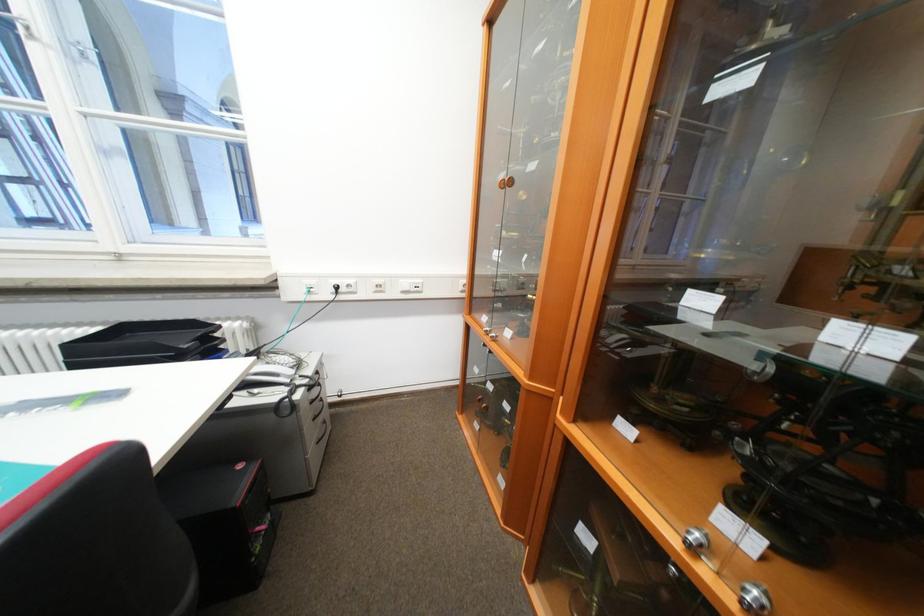
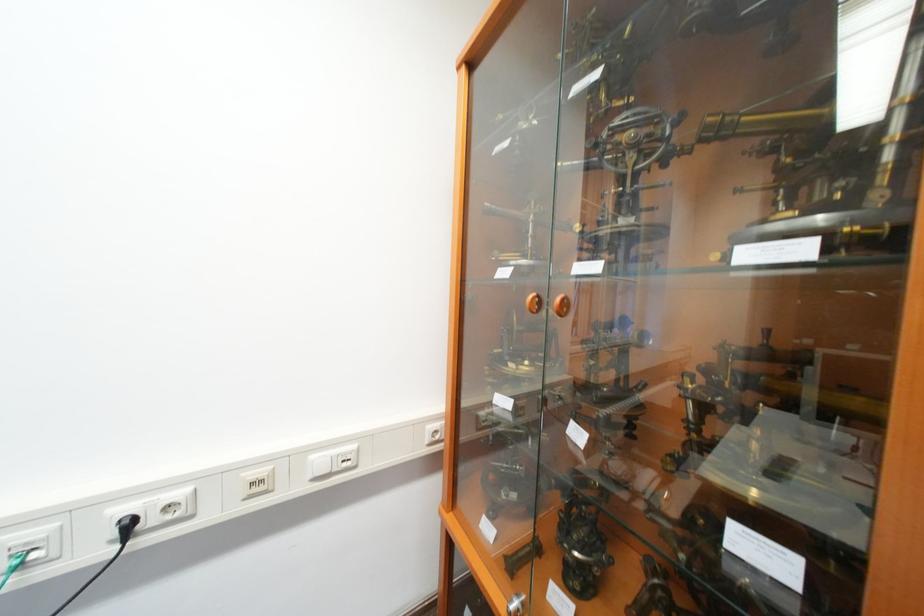
In the second image, find the point that corresponds to (x=494, y=329) in the first image.

(521, 602)